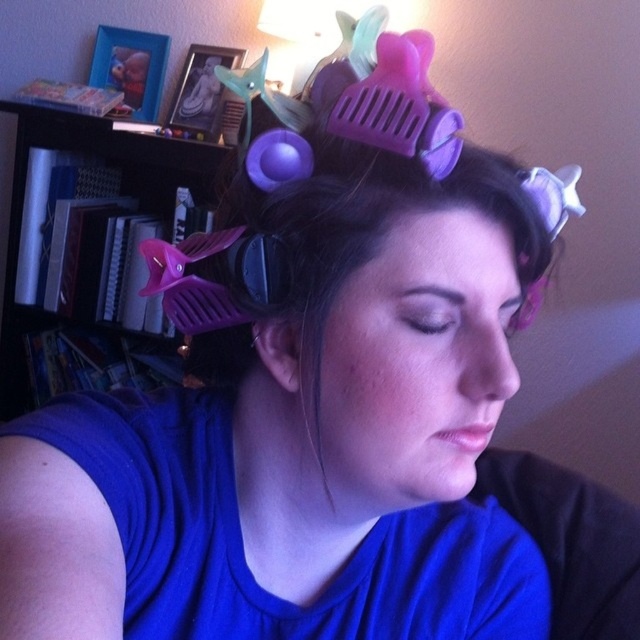
Is point (344, 262) closer to camera compared to point (140, 188)?

Yes, point (344, 262) is closer to viewer.

Is purple plastic hair rollers at center positioned before matte plastic bookshelf at left?

That is True.

Who is more forward, (x=401, y=218) or (x=113, y=300)?

Point (x=401, y=218) is more forward.

Find the location of a particular element. purple plastic hair rollers at center is located at coordinates (371, 253).

Based on the photo, can you confirm if purple plastic hair rollers at center is wider than purple plastic comb at upper center?

Correct, the width of purple plastic hair rollers at center exceeds that of purple plastic comb at upper center.

Is purple plastic hair rollers at center to the right of purple plastic comb at upper center from the viewer's perspective?

Correct, you'll find purple plastic hair rollers at center to the right of purple plastic comb at upper center.

Describe the element at coordinates (371, 253) in the screenshot. This screenshot has width=640, height=640. I see `purple plastic hair rollers at center` at that location.

Where is `purple plastic hair rollers at center`? purple plastic hair rollers at center is located at coordinates (371, 253).

In the scene shown: Can you confirm if matte plastic bookshelf at left is positioned below purple plastic comb at upper center?

Actually, matte plastic bookshelf at left is above purple plastic comb at upper center.

Does matte plastic bookshelf at left appear over purple plastic comb at upper center?

Correct, matte plastic bookshelf at left is located above purple plastic comb at upper center.

Is point (161, 172) farther from camera compared to point (161, 275)?

Yes.

This screenshot has width=640, height=640. Find the location of `matte plastic bookshelf at left`. matte plastic bookshelf at left is located at coordinates (90, 252).